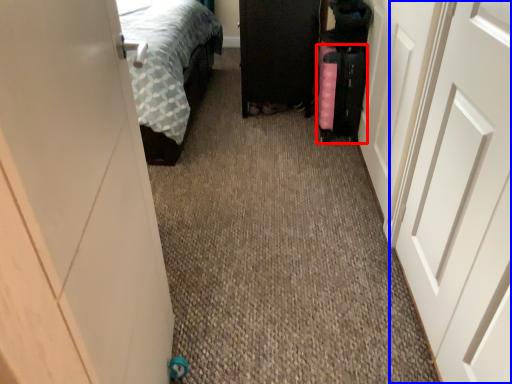
Question: Which point is further to the camera, luggage (highlighted by a red box) or door (highlighted by a blue box)?

Choices:
 (A) luggage
 (B) door

Answer: (A)